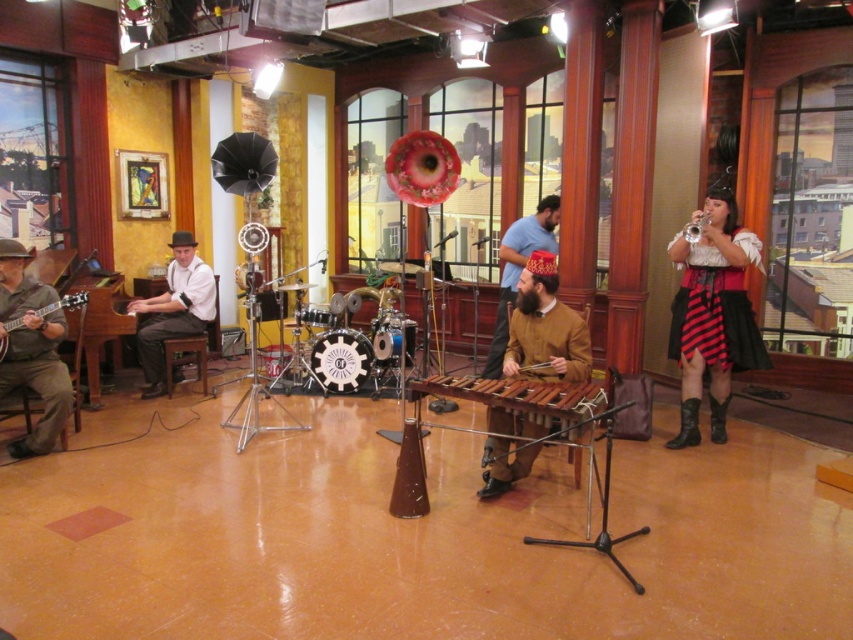
Question: Is striped skirt at right above matte brown acoustic guitar at left?

Choices:
 (A) yes
 (B) no

Answer: (A)

Question: Which point is closer to the camera?

Choices:
 (A) silver metallic trumpet at upper right
 (B) matte brown guitar at left

Answer: (B)

Question: Which point is closer to the camera?

Choices:
 (A) (6, 385)
 (B) (0, 362)
 (C) (569, 432)
 (D) (173, 314)

Answer: (C)

Question: Is matte brown acoustic guitar at left wider than silver metallic trumpet at upper right?

Choices:
 (A) no
 (B) yes

Answer: (B)

Question: Which object is farther from the camera taking this photo?

Choices:
 (A) striped skirt at right
 (B) silver metallic trumpet at upper right
 (C) brown leather jacket at center
 (D) wooden marimba at center

Answer: (B)

Question: Where is wooden marimba at center located in relation to silver metallic trumpet at upper right in the image?

Choices:
 (A) left
 (B) right

Answer: (A)